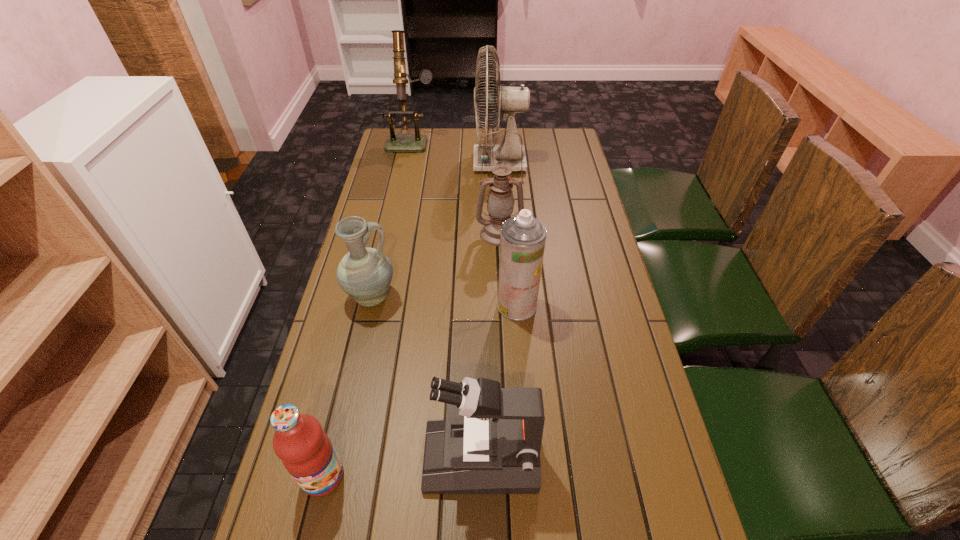
I want to click on microscope located at the far edge, so click(x=416, y=142).

Where is `microscope that is at the left edge`? This screenshot has width=960, height=540. microscope that is at the left edge is located at coordinates (416, 142).

Locate an element on the screen. The width and height of the screenshot is (960, 540). pitcher positioned at the left edge is located at coordinates point(365,274).

You are a GUI agent. You are given a task and a screenshot of the screen. Output one action in this format:
    pyautogui.click(x=<x>, y=<y>)
    Task: Click on the fruit juice present at the left edge
    This screenshot has width=960, height=540.
    Given the screenshot: What is the action you would take?
    pyautogui.click(x=306, y=451)

This screenshot has height=540, width=960. I want to click on object at the far left corner, so click(416, 142).

Where is `vacant space at the left edge of the desktop`? The image size is (960, 540). vacant space at the left edge of the desktop is located at coordinates (415, 161).

The image size is (960, 540). I want to click on vacant space at the right edge of the desktop, so click(612, 454).

Identify the location of vacant space that's between the left microscope and the pitcher. Image resolution: width=960 pixels, height=540 pixels. (392, 219).

This screenshot has height=540, width=960. Find the location of `free spot between the aerosol can and the shorter microscope`. free spot between the aerosol can and the shorter microscope is located at coordinates (499, 381).

This screenshot has width=960, height=540. In order to click on unoccupied position between the farther microscope and the fifth nearest object in this screenshot , I will do `click(456, 187)`.